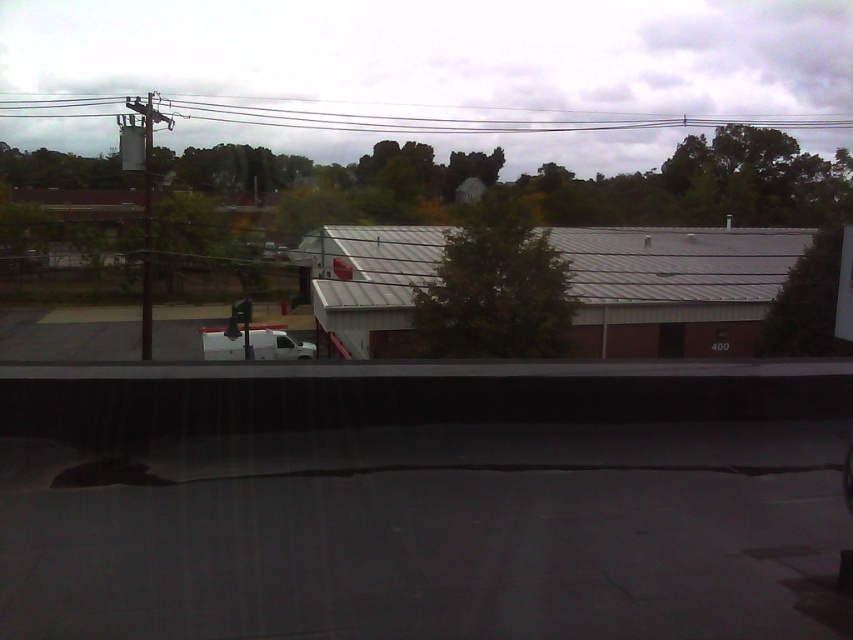
You are inside a vehicle and looking at the scene through the windshield. You notice the metallic gray shed at center. Can you determine its exact position in the image using coordinates?

The metallic gray shed at center is located at point coordinates [674,288].

You are a passenger in the car and notice the green leafy tree at right and the white matte van at center outside the window. Which object takes up more area in the scene?

The white matte van at center takes up more area in the scene than the green leafy tree at right because the green leafy tree at right occupies less space than white matte van at center.

You are a passenger in a car and looking out the window. You see a green leafy tree at center and a white matte van at center. Which object appears bigger in your view?

The green leafy tree at center appears bigger in size than the white matte van at center.